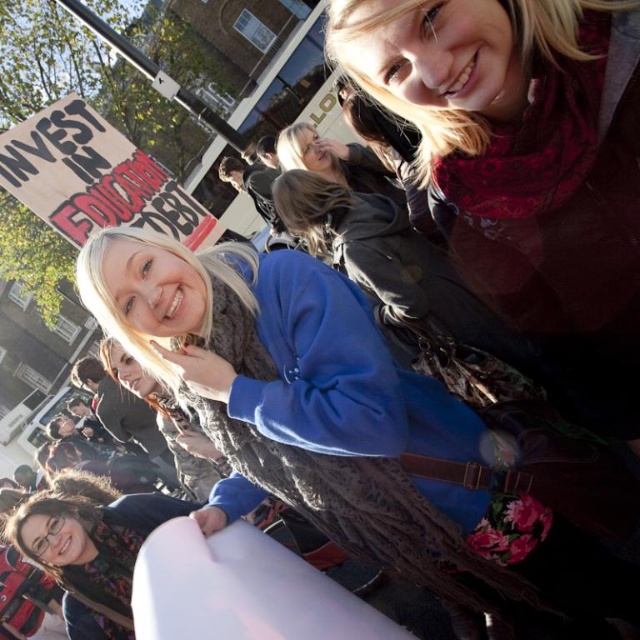
How far apart are blue fleece sweater at center and matte red scarf at upper right?

blue fleece sweater at center is 9.39 feet away from matte red scarf at upper right.

Is blue fleece sweater at center wider than matte red scarf at upper right?

No, blue fleece sweater at center is not wider than matte red scarf at upper right.

Does point (225, 337) lie in front of point (579, 320)?

No.

This screenshot has width=640, height=640. Identify the location of blue fleece sweater at center. (340, 424).